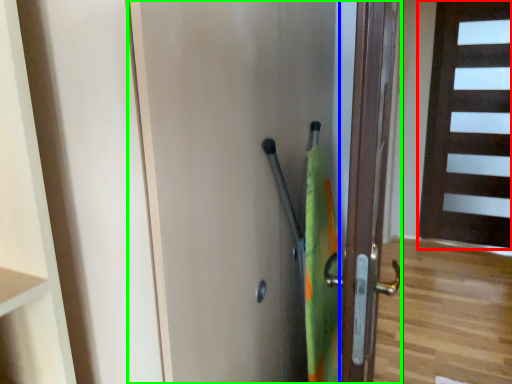
Question: Which object is the closest to the door (highlighted by a red box)? Choose among these: door (highlighted by a blue box) or door (highlighted by a green box).

Choices:
 (A) door
 (B) door

Answer: (A)